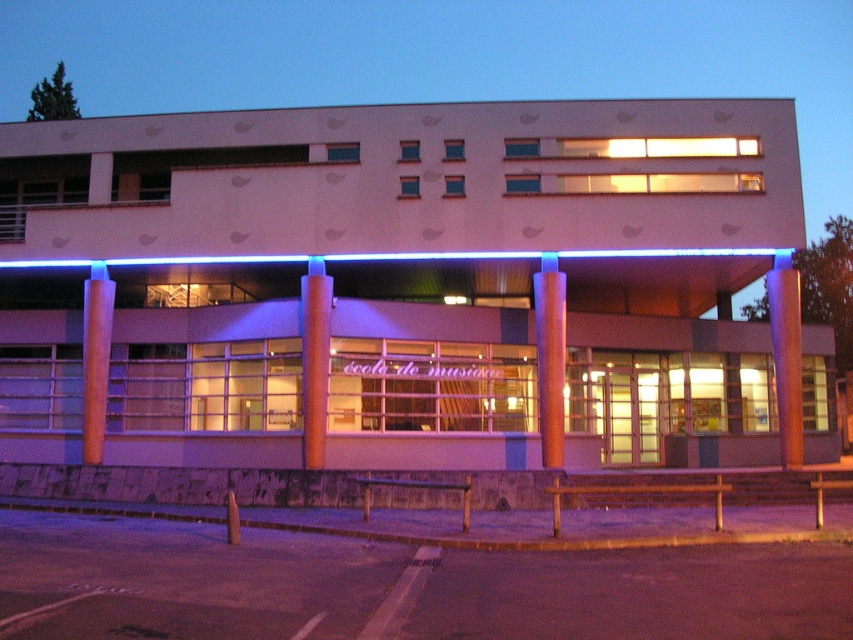
Which is in front, point (780, 320) or point (556, 438)?

Point (556, 438) is in front.

Between orange glossy pillar at right and smooth wood pillar at center, which one is positioned higher?

smooth wood pillar at center is above.

The height and width of the screenshot is (640, 853). What are the coordinates of `orange glossy pillar at right` in the screenshot? It's located at (786, 355).

Can you confirm if orange textured pillar at center is taller than brown polished wood pillar at left?

No, orange textured pillar at center is not taller than brown polished wood pillar at left.

Is the position of orange textured pillar at center less distant than that of brown polished wood pillar at left?

Yes, orange textured pillar at center is in front of brown polished wood pillar at left.

This screenshot has width=853, height=640. Identify the location of orange textured pillar at center. (314, 358).

Which is behind, point (786, 426) or point (96, 461)?

Positioned behind is point (96, 461).

Is point (784, 422) in front of point (86, 392)?

Yes, point (784, 422) is closer to viewer.

This screenshot has height=640, width=853. What do you see at coordinates (786, 355) in the screenshot? I see `orange glossy pillar at right` at bounding box center [786, 355].

Locate an element on the screen. orange glossy pillar at right is located at coordinates (786, 355).